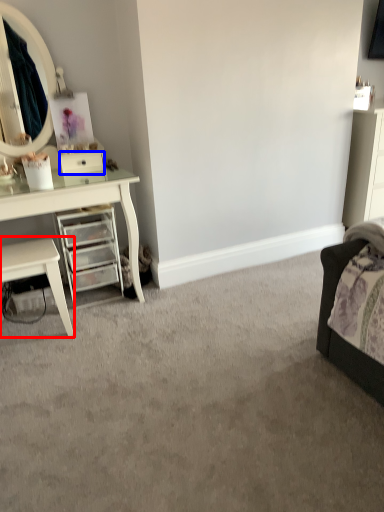
Question: Which of the following is the farthest to the observer, nightstand (highlighted by a red box) or drawer (highlighted by a blue box)?

Choices:
 (A) nightstand
 (B) drawer

Answer: (B)